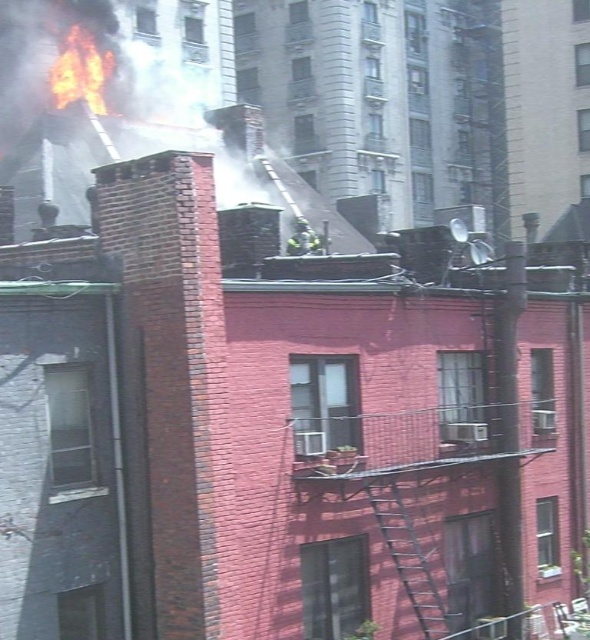
Is point (101, 49) positioned behind point (295, 243)?

Yes, point (101, 49) is behind point (295, 243).

Measure the distance between point (73,28) and camera.

48.76 meters

Measure the distance between flaming orange flames at upper left and camera.

flaming orange flames at upper left and camera are 155.31 feet apart from each other.

You are a GUI agent. You are given a task and a screenshot of the screen. Output one action in this format:
    pyautogui.click(x=<x>, y=<y>)
    Task: Click on the flaming orange flames at upper left
    
    Given the screenshot: What is the action you would take?
    pyautogui.click(x=80, y=70)

Is metallic silver ladder at center further to the viewer compared to green reflective uniform at center?

No, metallic silver ladder at center is in front of green reflective uniform at center.

Is metallic silver ladder at center taller than green reflective uniform at center?

Yes, metallic silver ladder at center is taller than green reflective uniform at center.

What do you see at coordinates (407, 556) in the screenshot?
I see `metallic silver ladder at center` at bounding box center [407, 556].

I want to click on metallic silver ladder at center, so click(407, 556).

Measure the distance between white smoke at upper center and camera.

25.51 meters

Which is more to the right, white smoke at upper center or metallic silver ladder at center?

From the viewer's perspective, metallic silver ladder at center appears more on the right side.

Is point (38, 160) closer to viewer compared to point (421, 564)?

That is False.

You are a GUI agent. You are given a task and a screenshot of the screen. Output one action in this format:
    pyautogui.click(x=<x>, y=<y>)
    Task: Click on the white smoke at upper center
    The height and width of the screenshot is (640, 590).
    Given the screenshot: What is the action you would take?
    pyautogui.click(x=135, y=108)